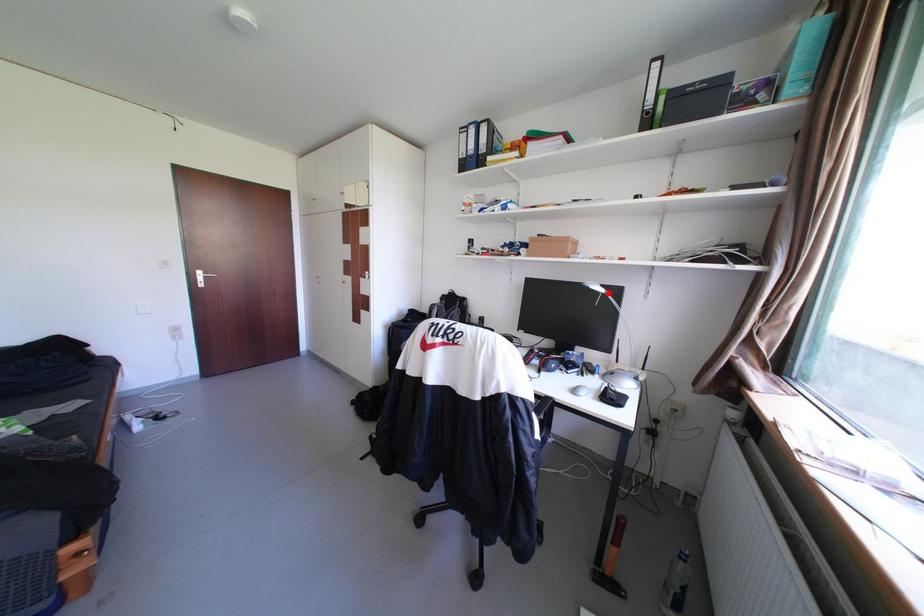
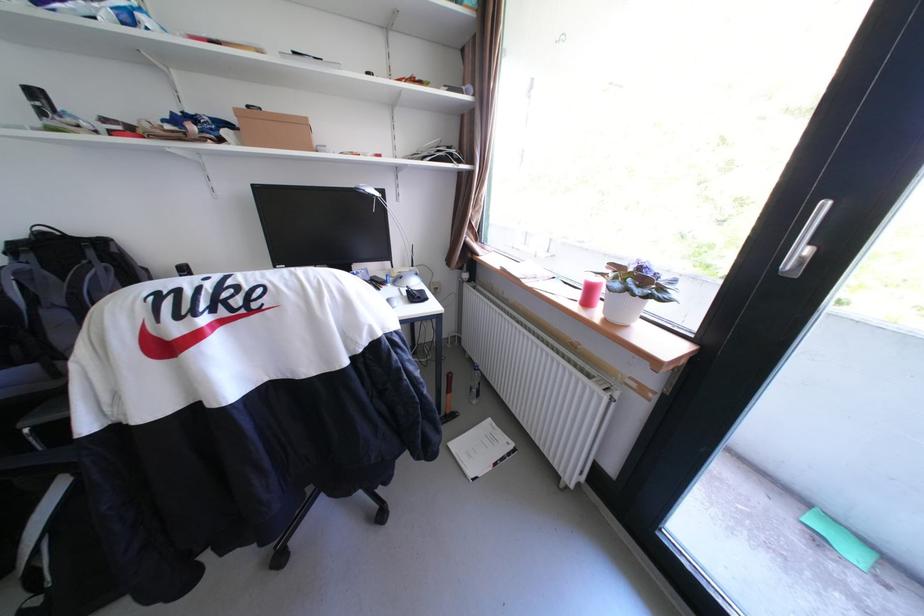
Where in the second image is the point corresponding to the highlighted location from the first image?

(382, 198)